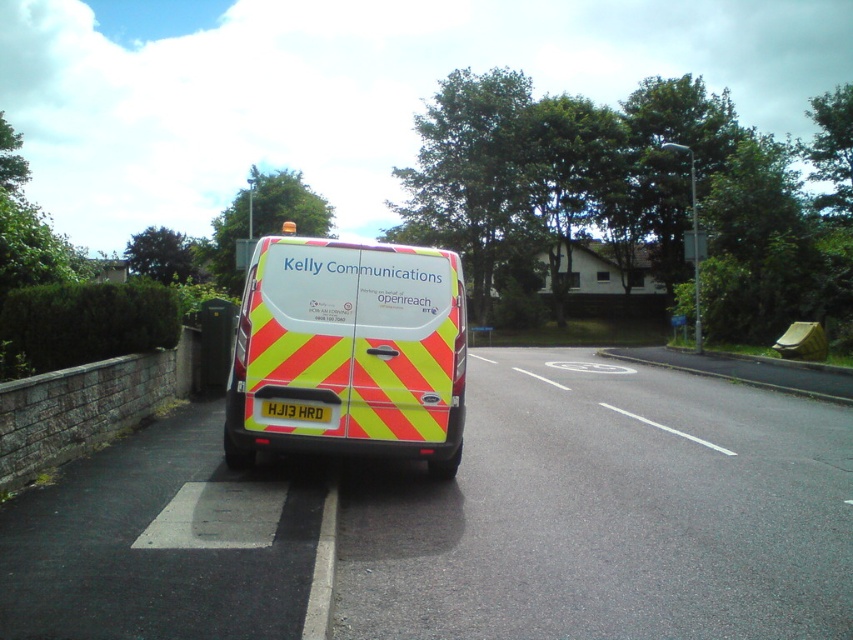
You are a delivery person trying to park your van next to the reflective yellow and red van at center. The parking space is narrow. Can you safely park your van without hitting the white plastic license plate at rear?

The reflective yellow and red van at center is larger than the white plastic license plate at rear, so there should be enough space to park safely without hitting the white plastic license plate at rear.

In the scene shown: You are a delivery person trying to park your car in a spot that can only accommodate vehicles narrower than the white plastic license plate at rear. Can the reflective yellow and red van at center fit into this parking spot?

The reflective yellow and red van at center is wider than the white plastic license plate at rear, so it cannot fit into a parking spot that only accommodates vehicles narrower than the license plate.